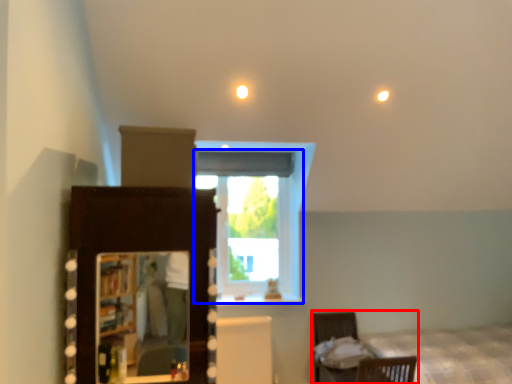
Question: Which object is closer to the camera taking this photo, furniture (highlighted by a red box) or window (highlighted by a blue box)?

Choices:
 (A) furniture
 (B) window

Answer: (A)